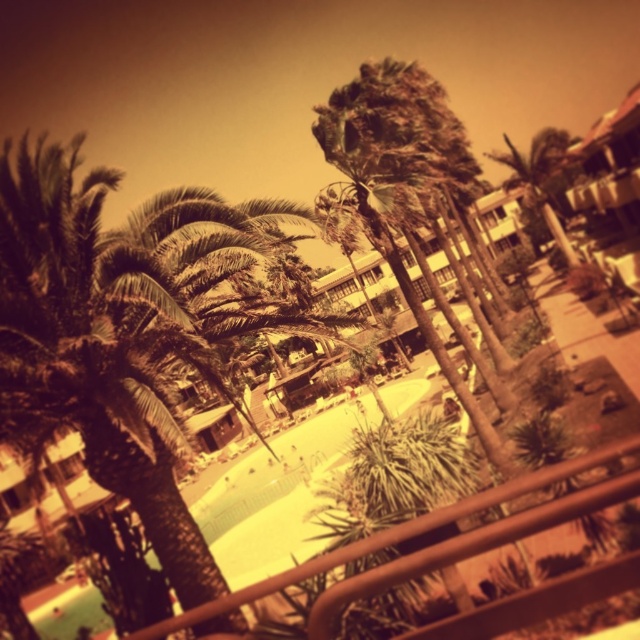
You are standing on a balcony and want to take a photo of both the brown metal railing at center and the green leafy palm tree at center. Which object will appear larger in the photo?

The green leafy palm tree at center will appear larger in the photo because it is bigger than the brown metal railing at center.

You are a painter standing on the balcony and want to paint the brown metal railing at center and the green leafy palm tree at center. Which object will require more horizontal space on your canvas?

The green leafy palm tree at center requires more horizontal space on the canvas because its width is greater than the brown metal railing at center.

Based on the photo, you are standing on a balcony overlooking a tropical resort. You notice a brown metal railing at center and a green leafy palm tree at center. Which object is taller?

The green leafy palm tree at center is taller than the brown metal railing at center.